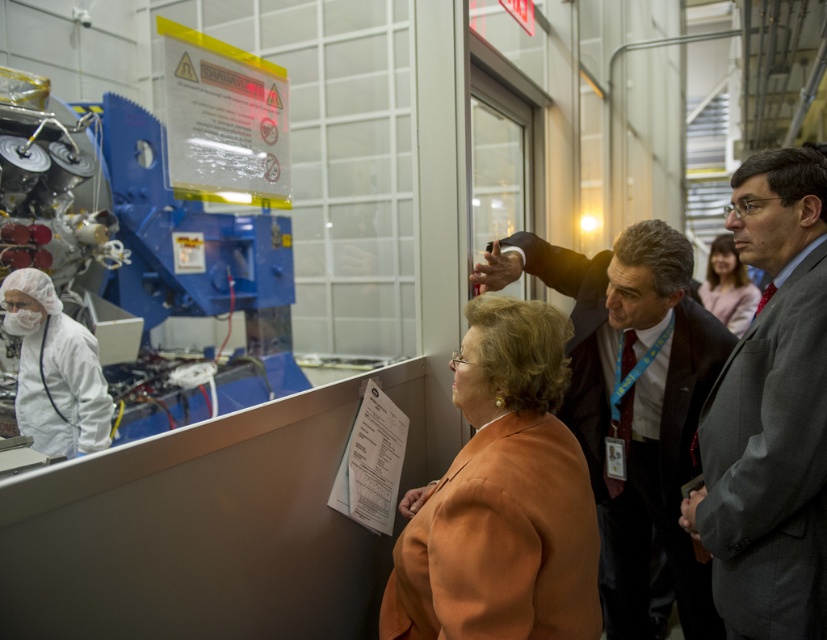
Can you confirm if gray suit at center is positioned to the left of matte orange blazer at center?

Indeed, gray suit at center is positioned on the left side of matte orange blazer at center.

Can you confirm if gray suit at center is thinner than matte orange blazer at center?

Indeed, gray suit at center has a lesser width compared to matte orange blazer at center.

Which is behind, point (739, 237) or point (739, 273)?

Point (739, 273)

This screenshot has height=640, width=827. Identify the location of gray suit at center. (770, 413).

Who is positioned more to the left, orange fabric jacket at center or matte orange blazer at center?

orange fabric jacket at center

Does point (566, 500) come in front of point (724, 298)?

Yes, it is.

This screenshot has height=640, width=827. I want to click on orange fabric jacket at center, so click(x=502, y=497).

The width and height of the screenshot is (827, 640). In order to click on orange fabric jacket at center in this screenshot , I will do `click(502, 497)`.

Does orange fabric jacket at center have a lesser width compared to gray suit at center?

In fact, orange fabric jacket at center might be wider than gray suit at center.

Does orange fabric jacket at center come in front of gray suit at center?

Yes, orange fabric jacket at center is closer to the viewer.

Does point (469, 458) lie in front of point (763, 595)?

Yes, it is.

The width and height of the screenshot is (827, 640). In order to click on orange fabric jacket at center in this screenshot , I will do `click(502, 497)`.